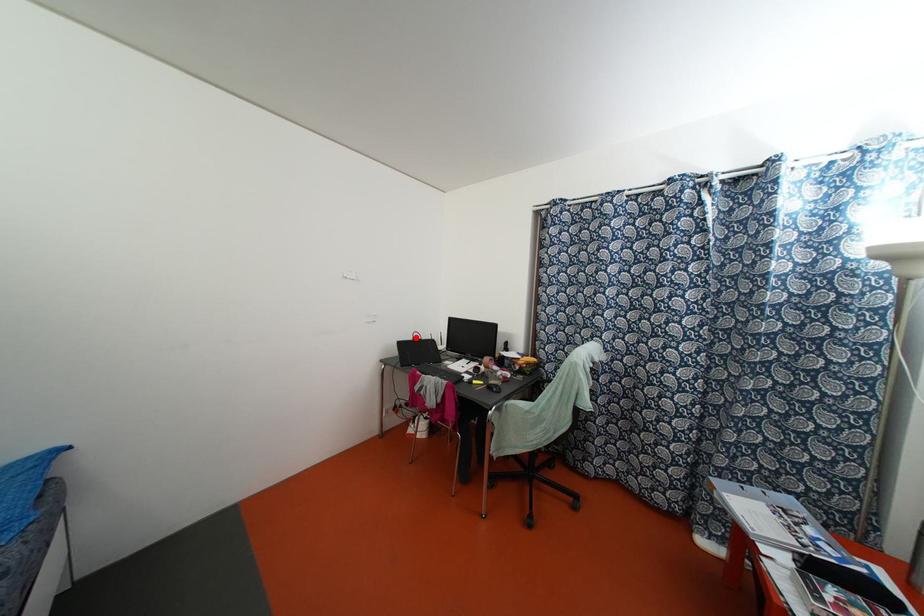
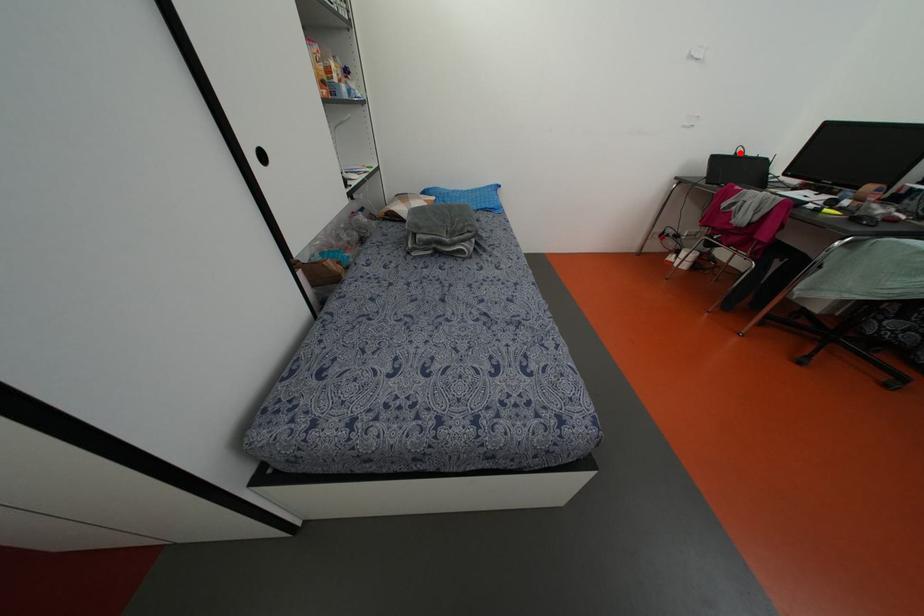
I am providing you with two images of the same scene from different viewpoints. A red point is marked on the first image and another point is marked on the second image. Does the point marked in image1 correspond to the same location as the one in image2?

Yes